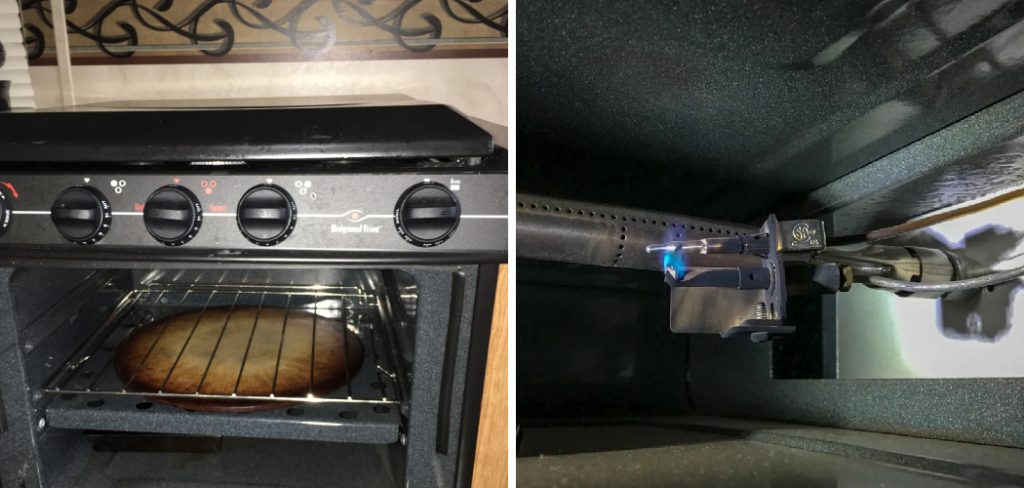
At what (x,y) coordinates should I click in order to perform the action: click on brown cabinet. Please return your answer as a coordinate pair (x, y). The width and height of the screenshot is (1024, 488). Looking at the image, I should click on (486, 458).